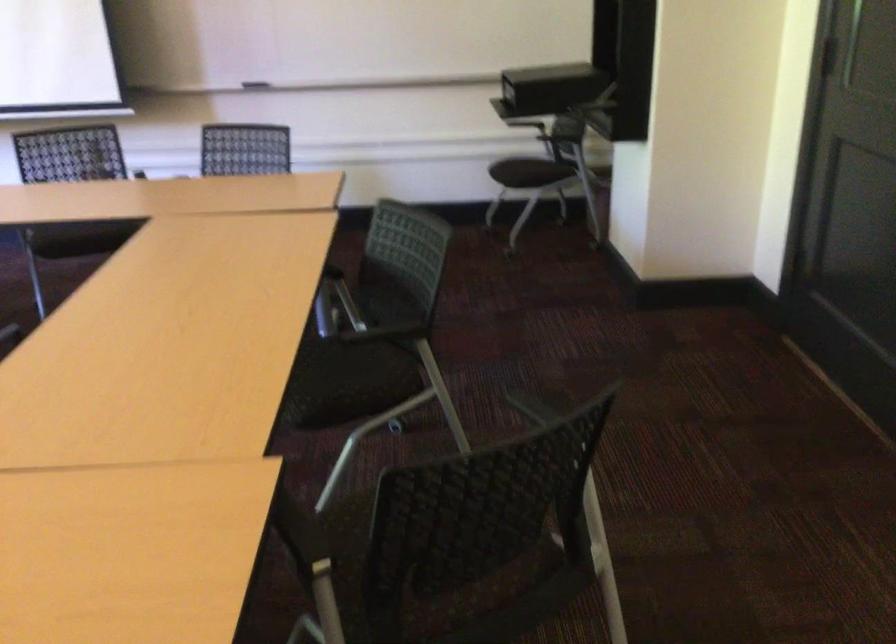
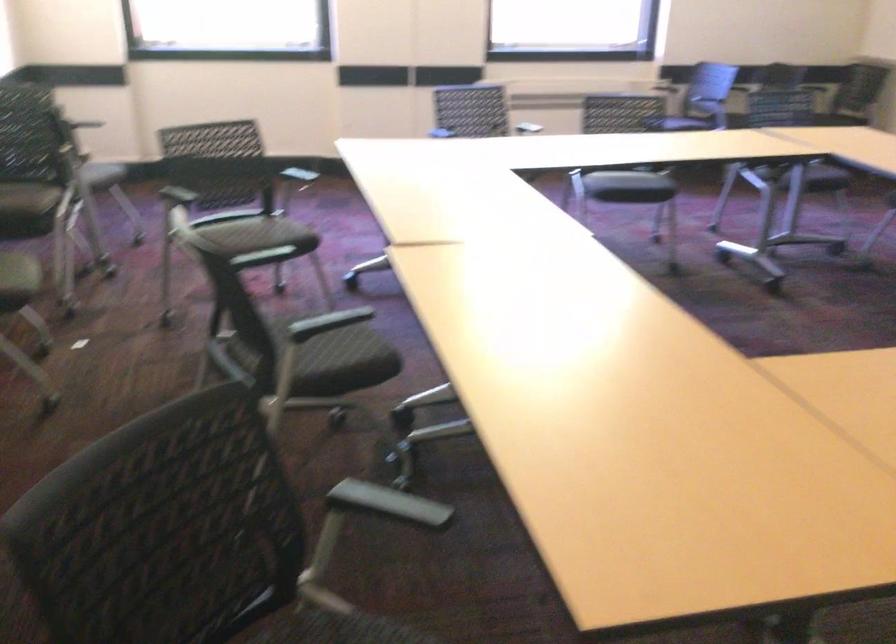
The first image is from the beginning of the video and the second image is from the end. How did the camera likely rotate when shooting the video?

The rotation direction of the camera is left-down.